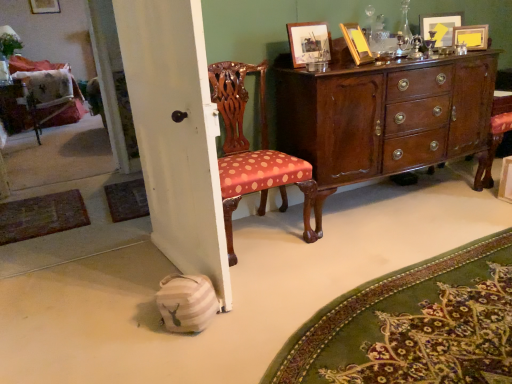
The width and height of the screenshot is (512, 384). Identify the location of vacant point to the right of green felt mat at lower left, the 1th mat when ordered from left to right. (109, 217).